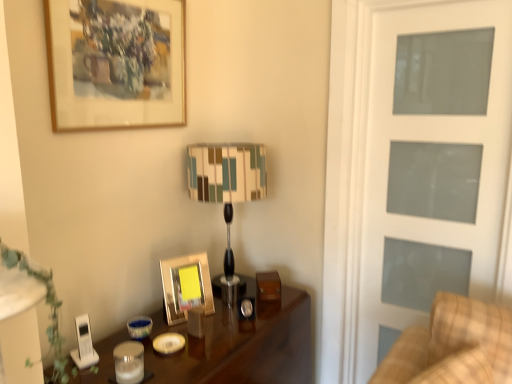
Locate an element on the screen. free space in front of gold metallic picture frame at center, which ranks as the 2th picture frame in top-to-bottom order is located at coordinates (189, 327).